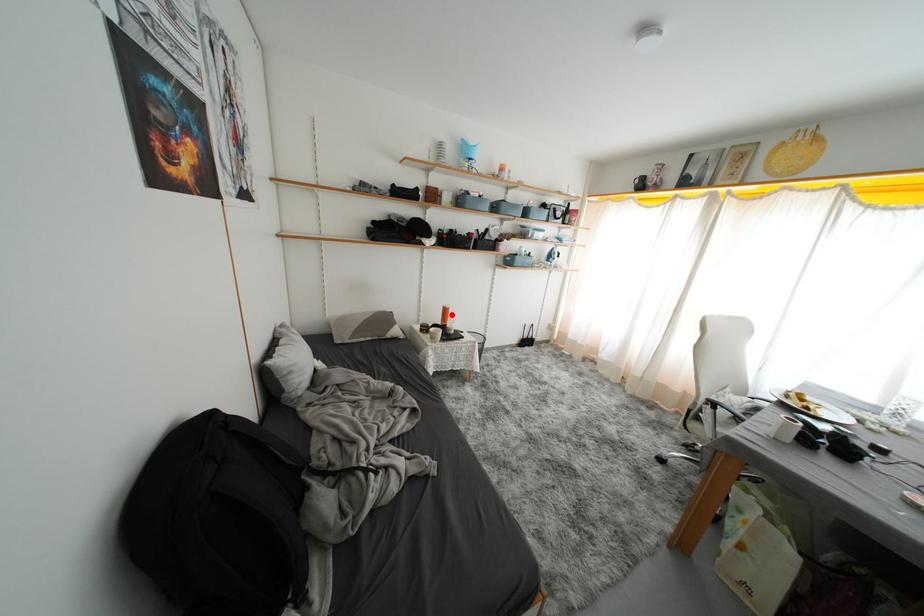
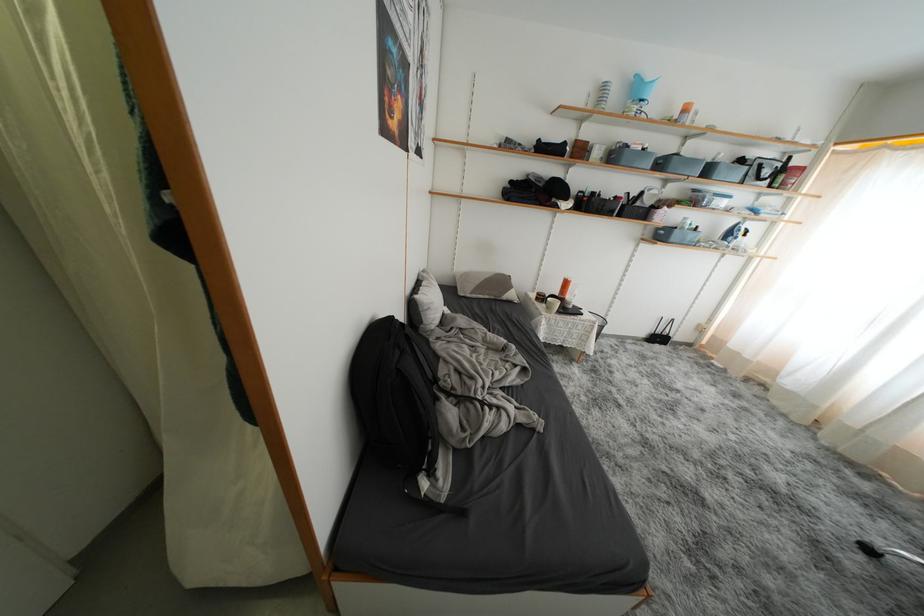
Question: I am providing you with two images of the same scene from different viewpoints. A red point is shown in image1. For the corresponding object point in image2, is it positioned nearer or farther from the camera?

Choices:
 (A) Nearer
 (B) Farther

Answer: (A)